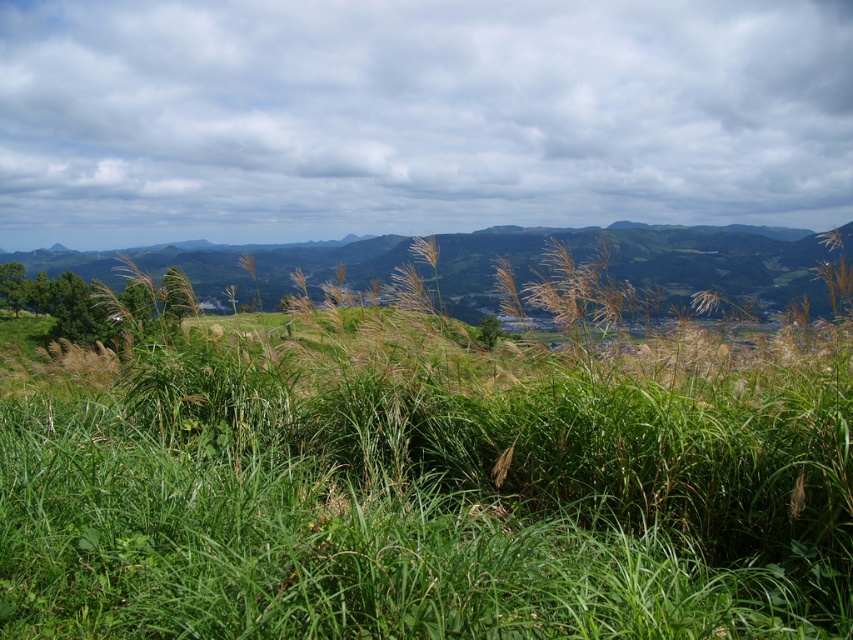
Question: Which object appears closest to the camera in this image?

Choices:
 (A) cloudy sky at upper center
 (B) green grassy at center

Answer: (B)

Question: Does green grassy at center have a greater width compared to cloudy sky at upper center?

Choices:
 (A) no
 (B) yes

Answer: (A)

Question: In this image, where is green grassy at center located relative to cloudy sky at upper center?

Choices:
 (A) left
 (B) right

Answer: (A)

Question: Is green grassy at center wider than cloudy sky at upper center?

Choices:
 (A) no
 (B) yes

Answer: (A)